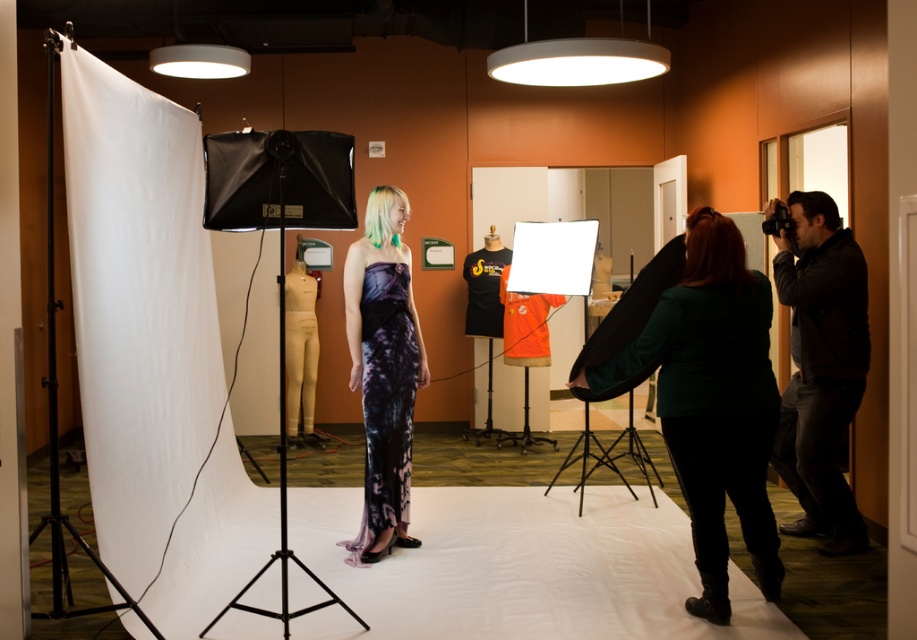
You are a photographer adjusting your camera position in the studio. You notice two points marked in the scene at coordinates point (670, 291) and point (402, 486). Which of these points is nearer to your current camera position?

Point (670, 291) is closer to the camera than point (402, 486).

You are a photographer in a studio and want to place a 24 inch wide prop between the green matte jacket at right and the dark brown leather jacket at right. Is there enough space between them to fit the prop?

The distance between the green matte jacket at right and the dark brown leather jacket at right is 36.45 inches. Since the prop is 24 inches wide, there is enough space to place it between them.